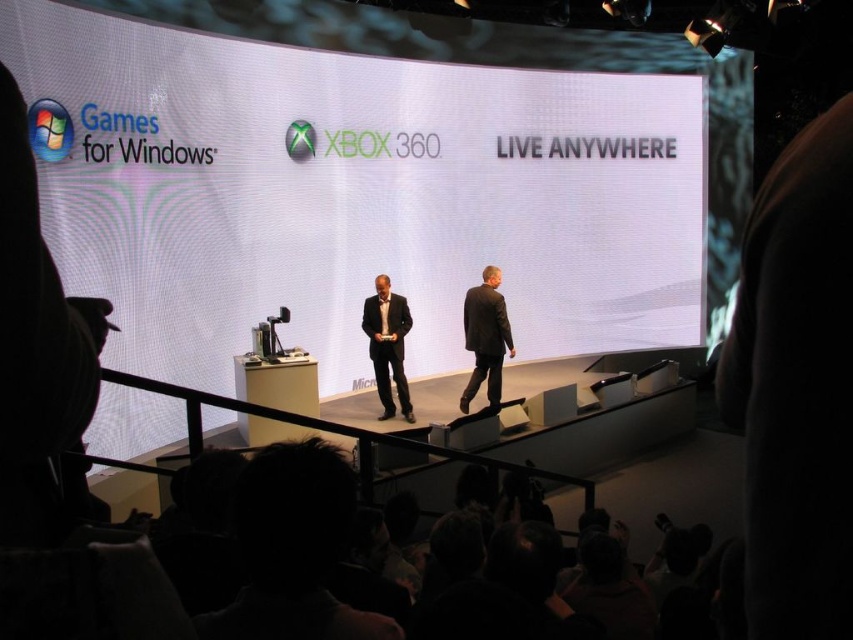
You are standing on the stage and need to quickly locate the dark gray suit at center. Based on the coordinates provided, can you determine if it is positioned closer to the front or the back of the stage?

The dark gray suit at center is located at coordinates point (485,337). Since the coordinates are in the middle range, it is positioned at the center of the stage, neither closer to the front nor the back.